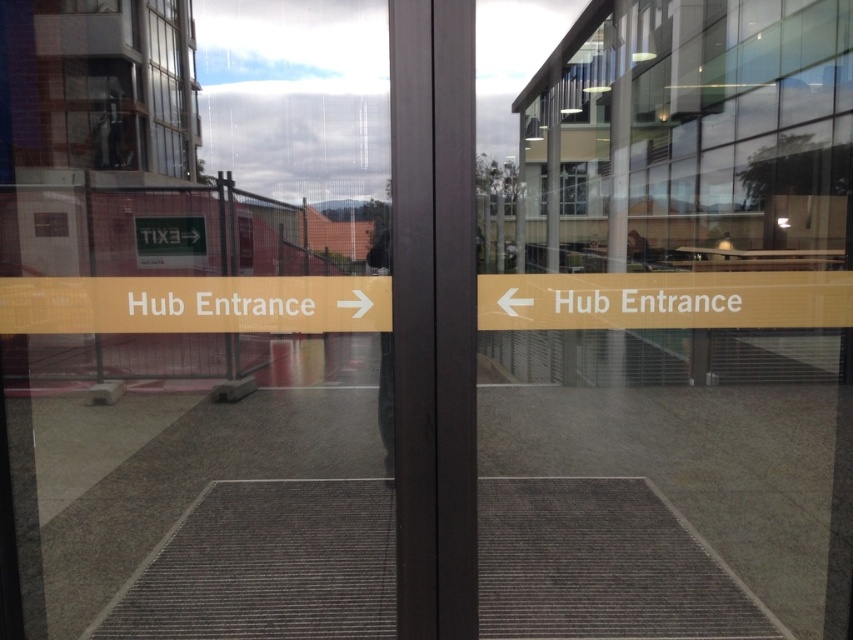
You are trying to enter the Hub Entrance and notice the transparent glass door at center and the clear glass window at upper left. Which one is taller?

The transparent glass door at center is much taller than the clear glass window at upper left.

You are standing in front of the glass door and want to touch both points on the glass. Which point, point (697, 172) or point (166, 49), will you reach first as you move your hand toward the door?

Point (697, 172) is further to the camera than point (166, 49), so you will reach point (166, 49) first as you move your hand toward the door.

You are standing outside the building and want to enter through the Hub Entrance. The transparent glass door at center and the clear glass window at upper left are both visible. Which one is bigger in size?

The transparent glass door at center is larger in size than the clear glass window at upper left, so the transparent glass door at center is bigger.